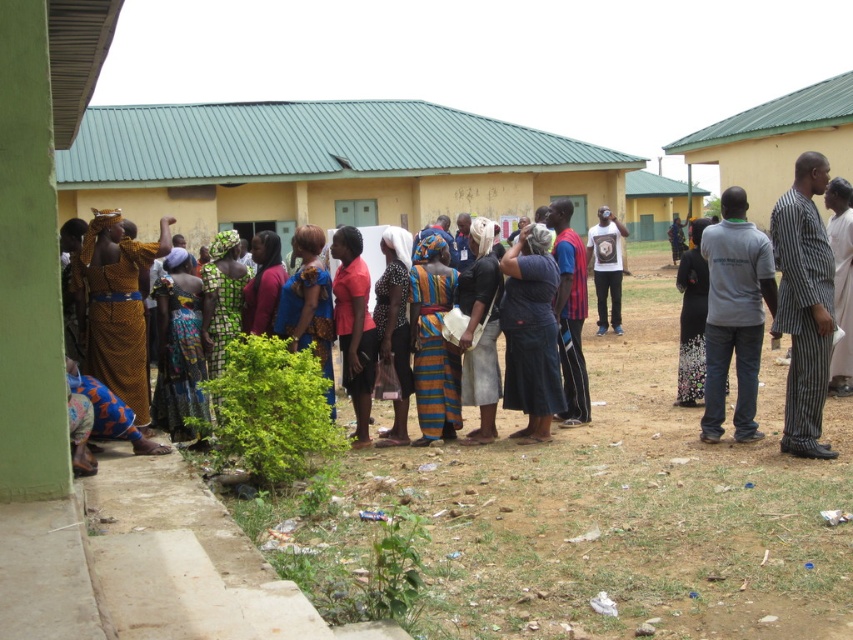
You are standing at the point with coordinates 0.5,0.8. You want to pick up the black printed dress at center. Can you reach it without moving your feet?

Yes, because the black printed dress at center is located at point (x=692, y=317), which is very close to your current position at (x=682, y=320).

You are organizing a community event and need to decide which fabric item to use for a decoration. The striped fabric dress at center and the multicolored woven cloth at center are available. Based on their thickness, which one would be more suitable for hanging as a banner?

The multicolored woven cloth at center is thicker than the striped fabric dress at center, making it more suitable for hanging as a banner because it can hold its shape better.

You are a photographer trying to capture a detailed shot of both the black printed dress at center and the matte red shirt at center. Since your camera can only focus on one subject at a time, which one should you adjust your focus to first to ensure the other is still in the frame?

You should focus on the matte red shirt at center first because the black printed dress at center is to the right of it, so adjusting focus to the left side first will keep both in frame when moving the camera slightly right.